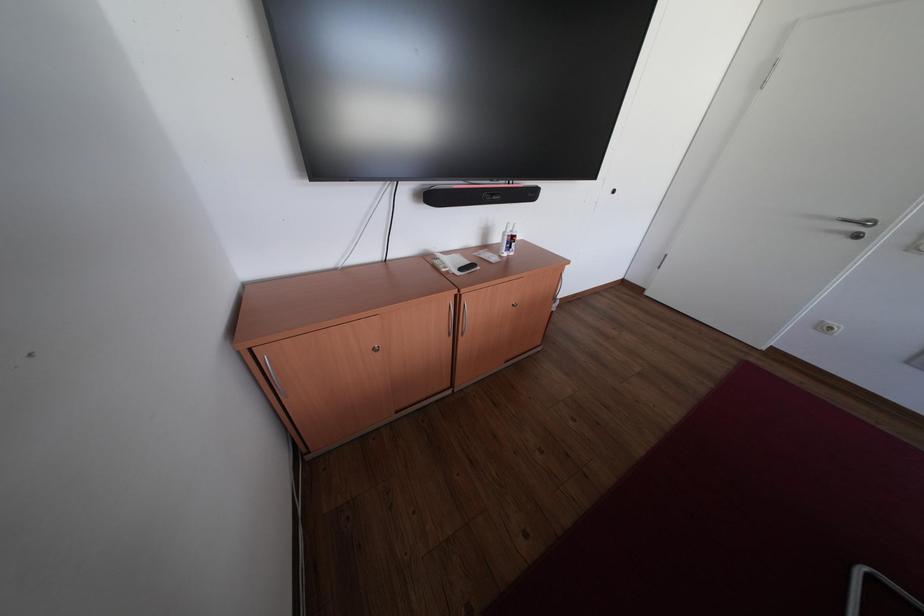
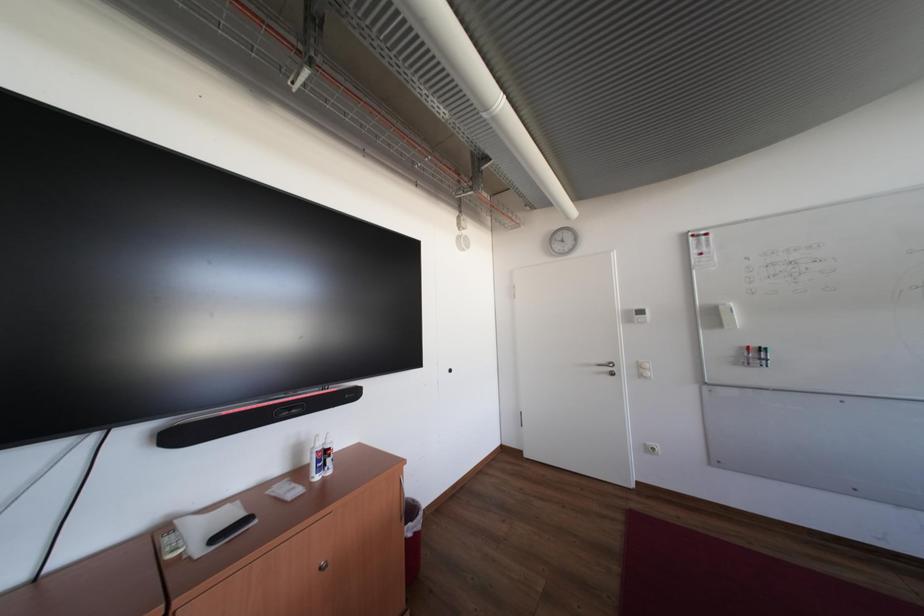
The images are taken continuously from a first-person perspective. In which direction is your viewpoint rotating?

The camera rotated toward right-up.